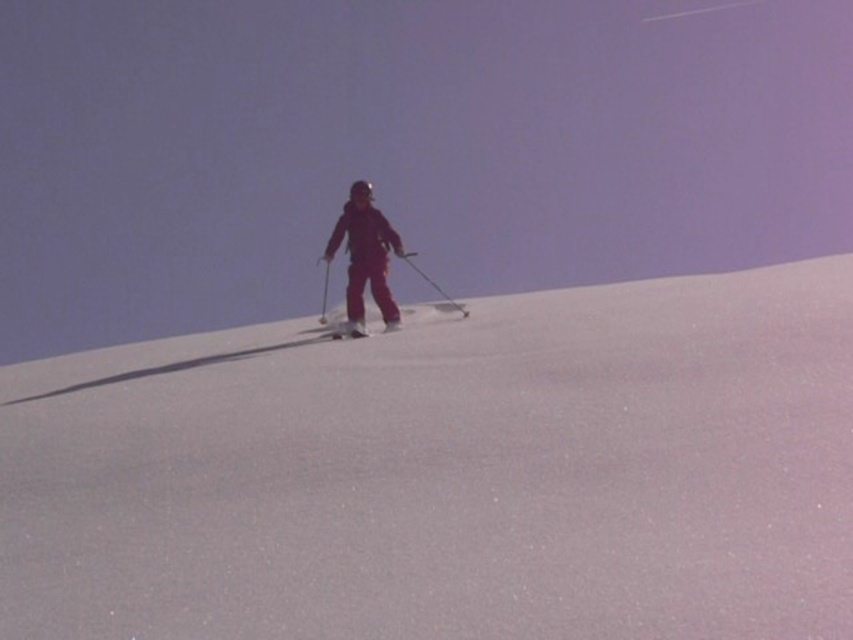
Who is more forward, (x=558, y=483) or (x=352, y=333)?

Point (x=558, y=483) is in front.

Is point (795, 340) positioned before point (401, 324)?

That is True.

Where is `white powder snow at center`? white powder snow at center is located at coordinates (450, 474).

Can you confirm if white powder snow at center is smaller than matte red ski suit at center?

No, white powder snow at center is not smaller than matte red ski suit at center.

Is white powder snow at center to the right of matte red ski suit at center from the viewer's perspective?

Indeed, white powder snow at center is positioned on the right side of matte red ski suit at center.

Is point (19, 618) positioned after point (397, 310)?

No, it is not.

Where is `white powder snow at center`? Image resolution: width=853 pixels, height=640 pixels. white powder snow at center is located at coordinates (450, 474).

Who is shorter, matte red ski suit at center or white matte ski at center?

white matte ski at center is shorter.

Is point (352, 300) less distant than point (347, 324)?

No, (352, 300) is behind (347, 324).

Does point (370, 241) lie in front of point (339, 328)?

No, (370, 241) is behind (339, 328).

Image resolution: width=853 pixels, height=640 pixels. I want to click on matte red ski suit at center, so click(x=364, y=259).